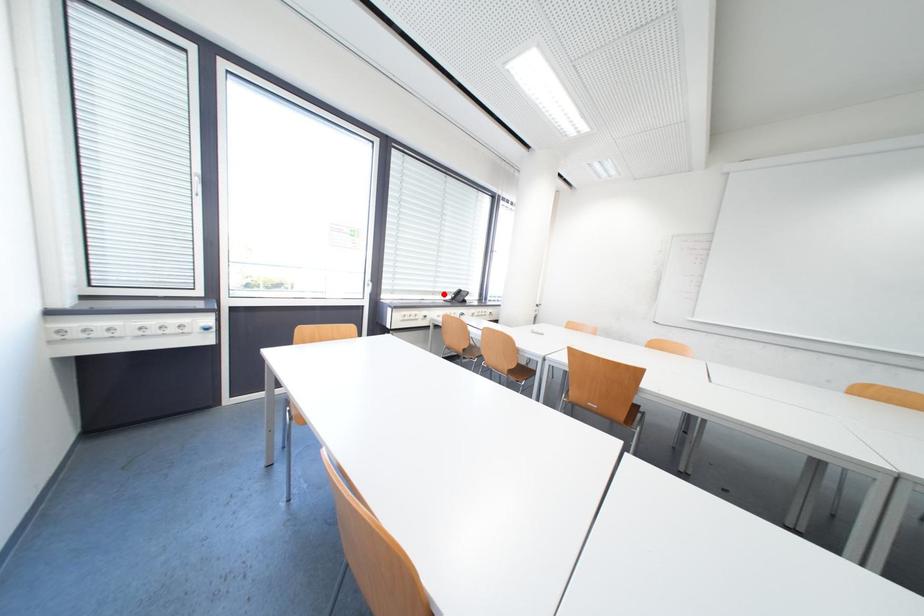
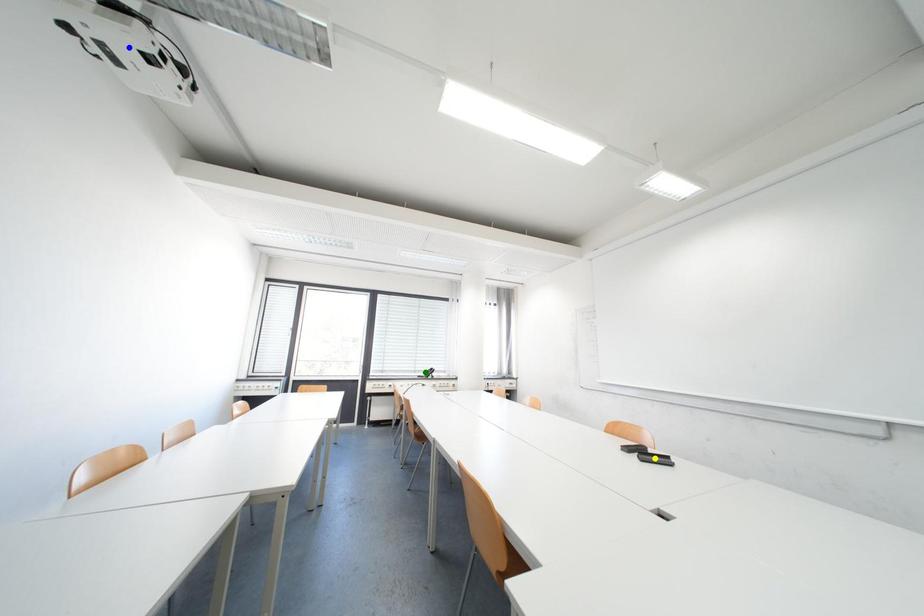
Question: I am providing you with two images of the same scene from different viewpoints. A red point is marked on the first image. You are given multiple points on the second image. Which spot in image 2 lines up with the point in image 1?

Choices:
 (A) green point
 (B) yellow point
 (C) blue point

Answer: (A)